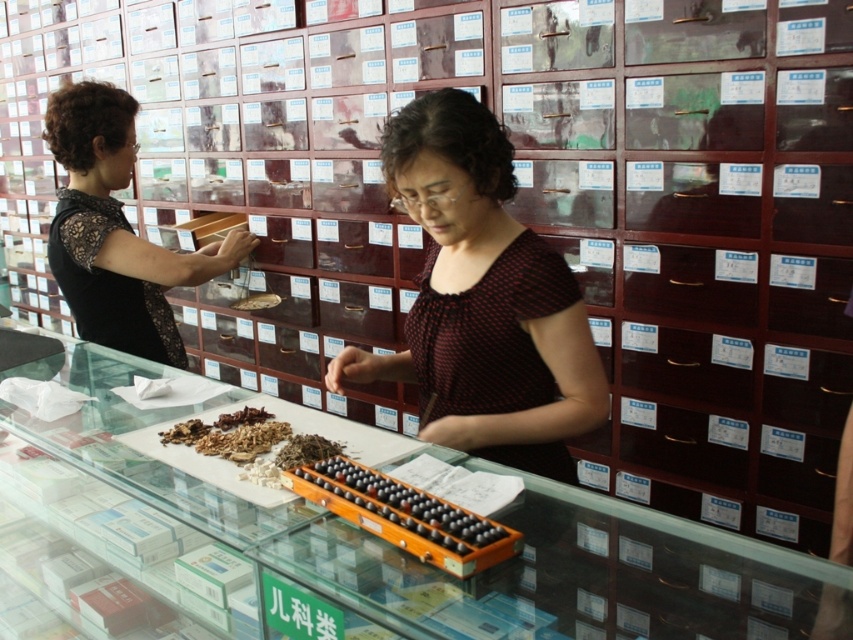
You are a customer in the Chinese medicine shop. You need to find the dark red dotted blouse at center. Where should you look relative to the counter?

The dark red dotted blouse at center is located at point (482, 300) on the counter, so you should look near the center of the counter to find it.

You are a customer in the shop and want to place your order on the counter. Where should you place your order so that it is closest to the wooden abacus at center?

You should place your order near the center of the counter, specifically at the coordinates mentioned in the description, which is point (403, 513), to be closest to the wooden abacus at center.

You are a customer standing in front of the counter in the Chinese medicine shop. You want to hand the shopkeeper a note from your pocket. Which object, the dark red dotted blouse at center or the wooden abacus at center, is closer to you that you can reach first?

The dark red dotted blouse at center is closer to you than the wooden abacus at center, so you can reach it first.